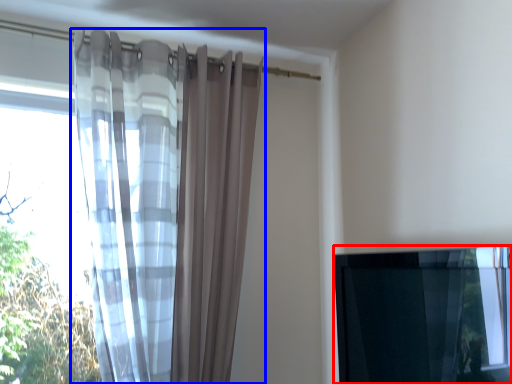
Question: Which object is further to the camera taking this photo, window (highlighted by a red box) or curtain (highlighted by a blue box)?

Choices:
 (A) window
 (B) curtain

Answer: (B)